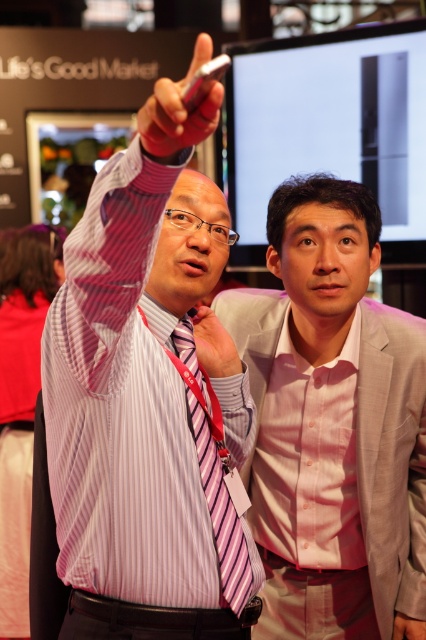
You are organizing a clothing size chart for an online store. You have two items to list based on the image provided. The first item is the striped fabric shirt at left, and the second is the pink fabric at upper center. Which item should you list as having a larger size?

The striped fabric shirt at left is larger in size than the pink fabric at upper center, so you should list the striped fabric shirt at left as the larger size item.

You are at a tech event and see the striped fabric shirt at left and the pink fabric at upper center. Which fabric is positioned to the left of the other?

The striped fabric shirt at left is positioned on the left side of pink fabric at upper center.